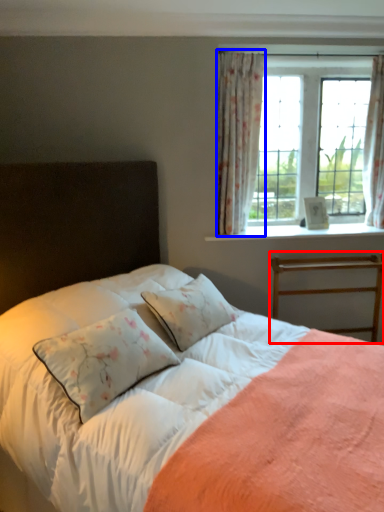
Question: Among these objects, which one is farthest to the camera, bed frame (highlighted by a red box) or curtain (highlighted by a blue box)?

Choices:
 (A) bed frame
 (B) curtain

Answer: (A)